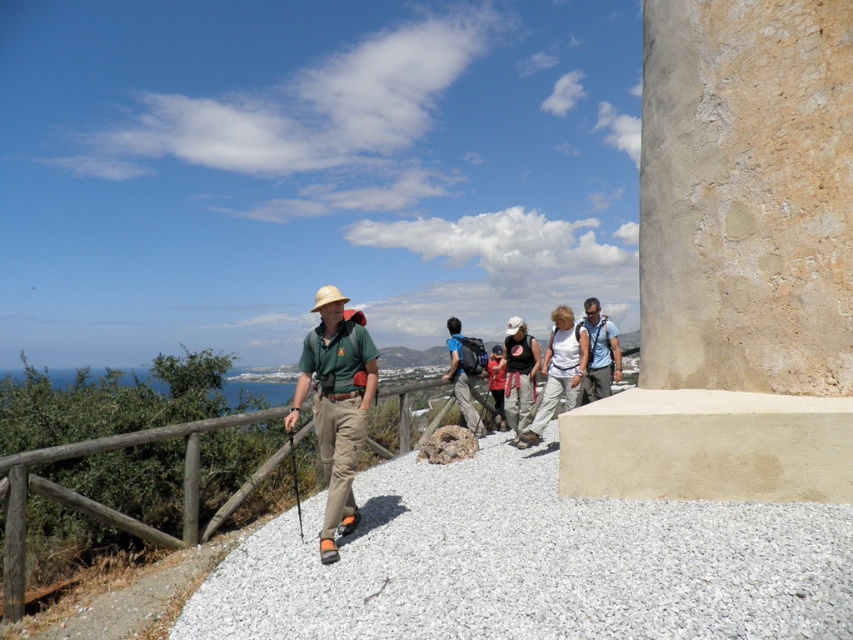
Which is below, matte green shirt at center or matte black tank top at center?

matte black tank top at center

Does matte green shirt at center have a lesser height compared to matte black tank top at center?

No.

Find the location of a particular element. This screenshot has height=640, width=853. matte green shirt at center is located at coordinates (335, 404).

In the scene shown: Measure the distance from smooth concrete pillar at right to matte red backpack at center.

smooth concrete pillar at right is 5.29 meters away from matte red backpack at center.

Is smooth concrete pillar at right wider than matte red backpack at center?

Yes.

Is point (634, 493) less distant than point (489, 356)?

Yes.

The image size is (853, 640). In order to click on smooth concrete pillar at right in this screenshot , I will do `click(735, 262)`.

Can you confirm if matte green shirt at center is positioned to the left of white cotton shirt at center?

Yes, matte green shirt at center is to the left of white cotton shirt at center.

Between matte green shirt at center and white cotton shirt at center, which one is positioned higher?

white cotton shirt at center is higher up.

You are a GUI agent. You are given a task and a screenshot of the screen. Output one action in this format:
    pyautogui.click(x=<x>, y=<y>)
    Task: Click on the matte green shirt at center
    This screenshot has height=640, width=853.
    Given the screenshot: What is the action you would take?
    pyautogui.click(x=335, y=404)